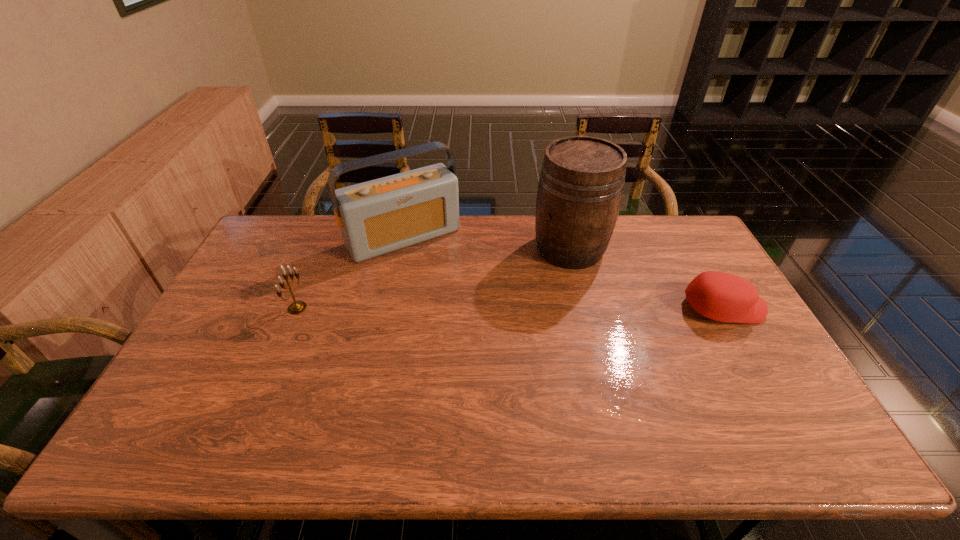
What are the coordinates of `the leftmost object` in the screenshot? It's located at (297, 307).

The height and width of the screenshot is (540, 960). Find the location of `the third tallest object`. the third tallest object is located at coordinates (297, 307).

Locate an element on the screen. cap is located at coordinates (724, 297).

The width and height of the screenshot is (960, 540). Identify the location of the rightmost object. tap(724, 297).

Image resolution: width=960 pixels, height=540 pixels. I want to click on the second object from right to left, so click(x=580, y=189).

You are a GUI agent. You are given a task and a screenshot of the screen. Output one action in this format:
    pyautogui.click(x=<x>, y=<y>)
    Task: Click on the radio receiver
    
    Given the screenshot: What is the action you would take?
    pyautogui.click(x=376, y=217)

I want to click on vacant region located 0.190m on the right of the leftmost object, so click(x=370, y=308).

Locate an element on the screen. The height and width of the screenshot is (540, 960). free spot located on the side of the cider near the bung hole is located at coordinates (512, 281).

Where is `vacant space located 0.310m on the side of the cider near the bung hole`? vacant space located 0.310m on the side of the cider near the bung hole is located at coordinates (469, 305).

The width and height of the screenshot is (960, 540). What are the coordinates of `vacant region located on the side of the cider near the bung hole` in the screenshot? It's located at (459, 311).